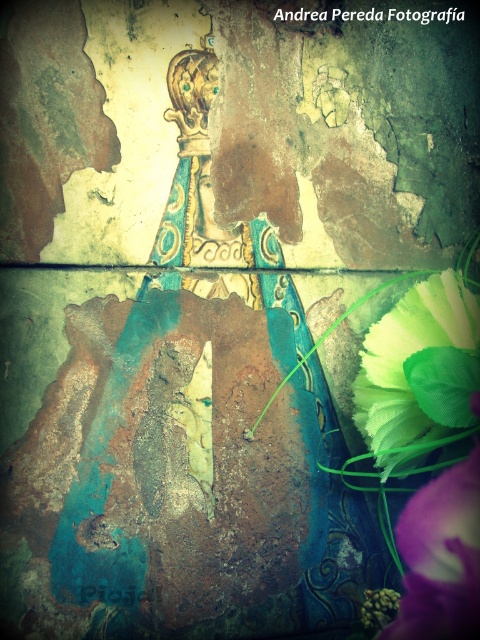
Is translucent yellow-green fabric at lower right closer to the viewer compared to purple matte flower at lower right?

Yes.

Who is taller, translucent yellow-green fabric at lower right or purple matte flower at lower right?

With more height is translucent yellow-green fabric at lower right.

Is point (355, 417) positioned before point (458, 557)?

No, (355, 417) is behind (458, 557).

Find the location of a particular element. Image resolution: width=480 pixels, height=640 pixels. translucent yellow-green fabric at lower right is located at coordinates click(x=420, y=372).